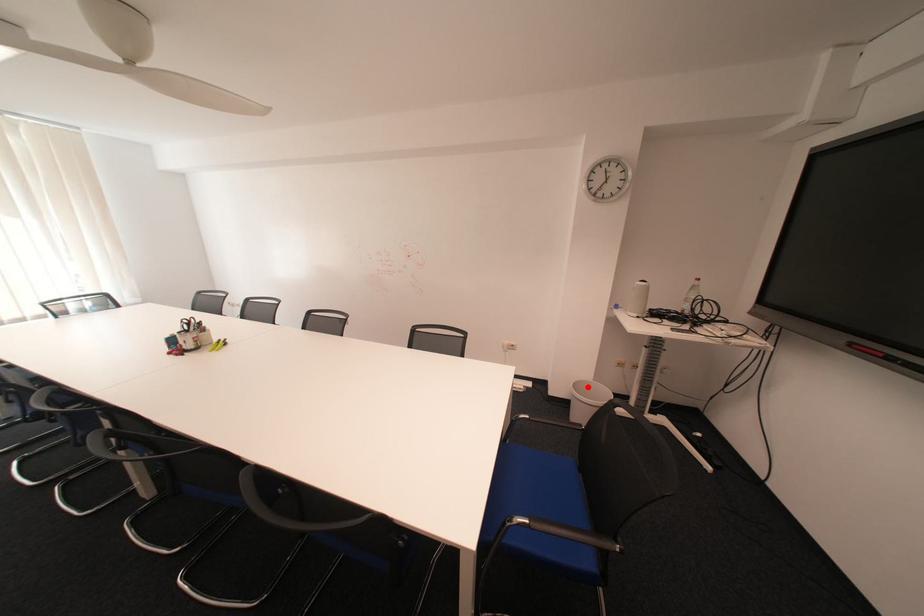
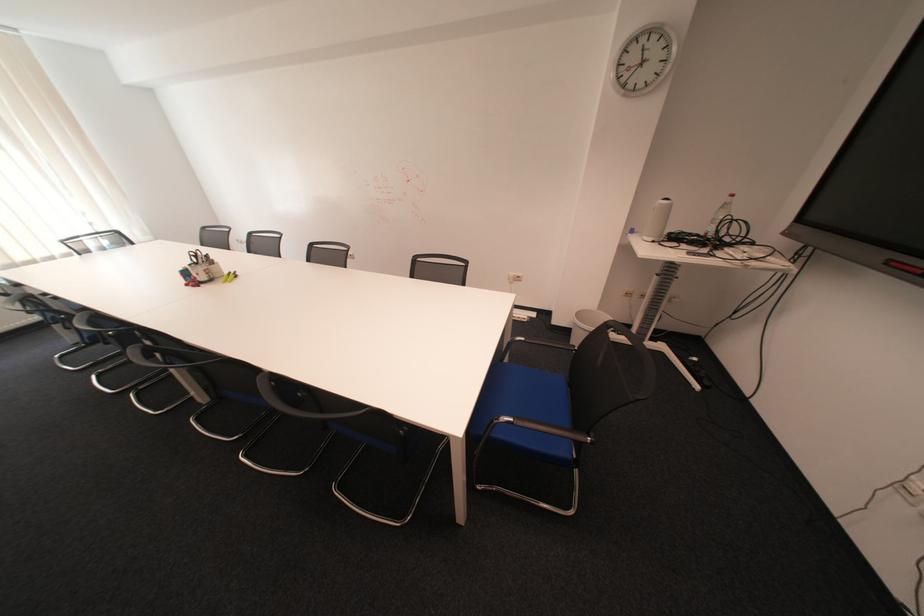
Where in the second image is the point corresponding to the highlighted location from the first image?

(590, 315)